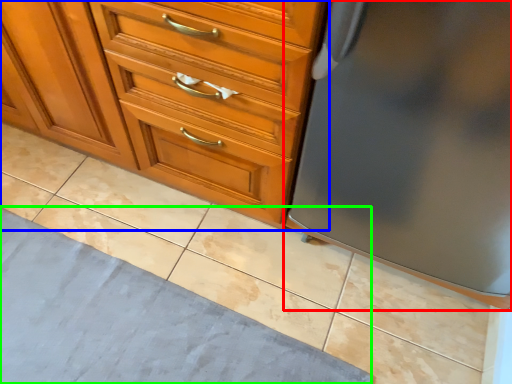
Question: Which object is positioned farthest from refrigerator (highlighted by a red box)? Select from chest of drawers (highlighted by a blue box) and bath mat (highlighted by a green box).

Choices:
 (A) chest of drawers
 (B) bath mat

Answer: (B)